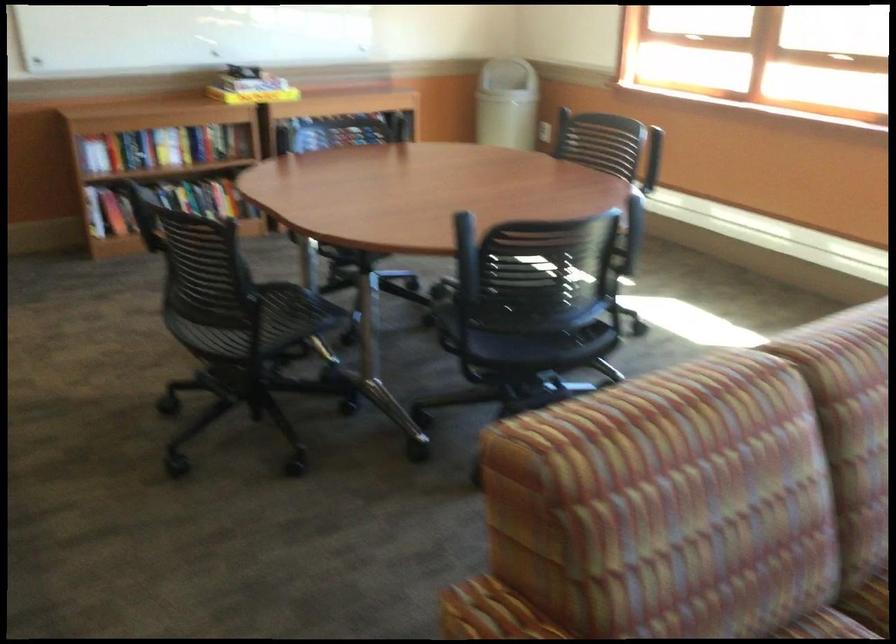
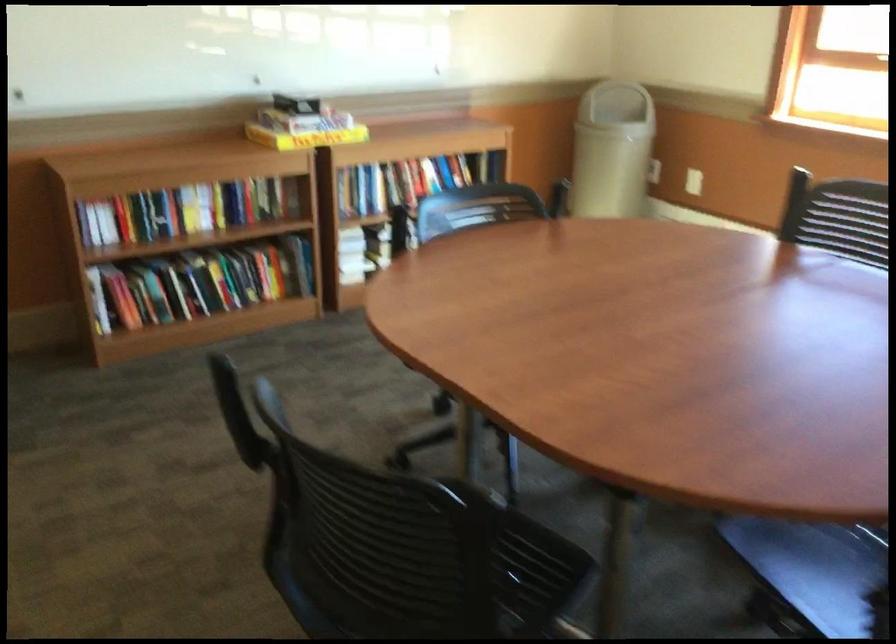
Where in the second image is the point corresponding to (247,93) from the first image?

(306, 138)